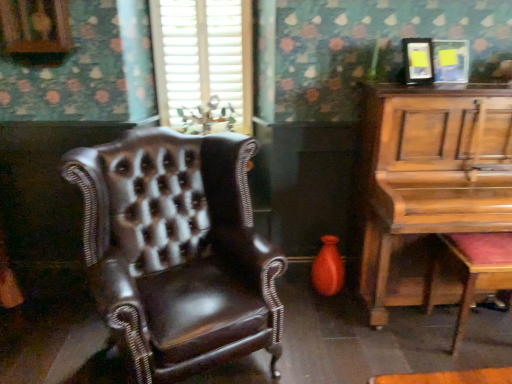
Find the location of a particular element. This screenshot has height=384, width=512. free space between wooden polished music stool at lower right and wooden piano at right is located at coordinates (420, 357).